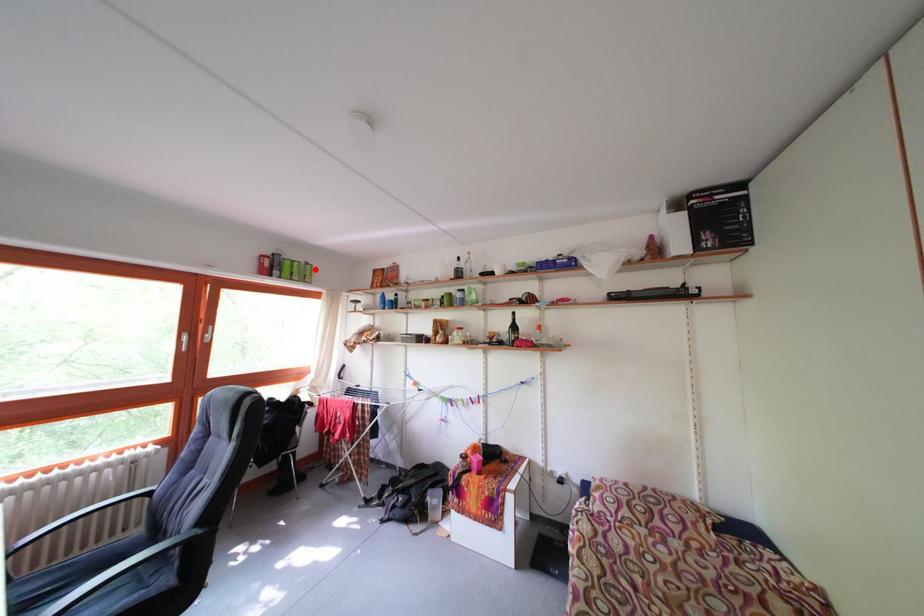
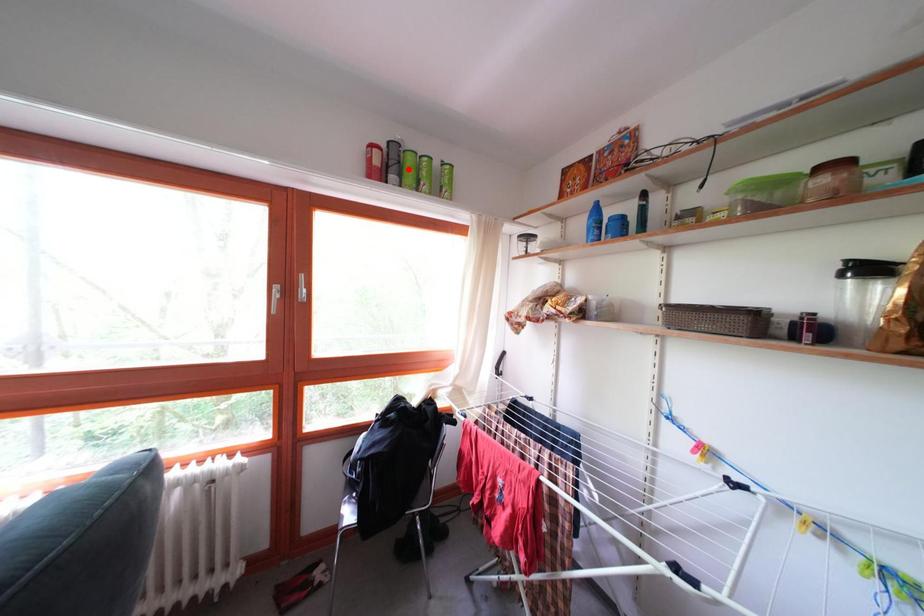
I am providing you with two images of the same scene from different viewpoints. A red point is marked on the first image and another point is marked on the second image. Do the highlighted points in image1 and image2 indicate the same real-world spot?

No